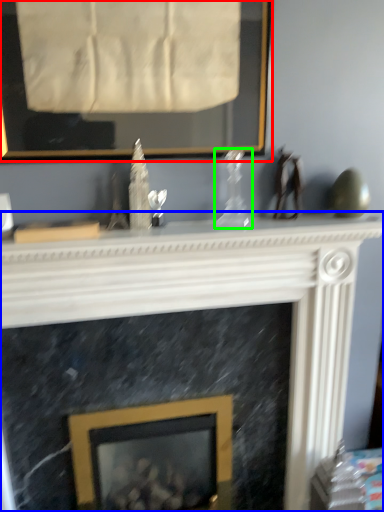
Question: Considering the real-world distances, which object is farthest from picture frame (highlighted by a red box)? fireplace (highlighted by a blue box) or glass vase (highlighted by a green box)?

Choices:
 (A) fireplace
 (B) glass vase

Answer: (A)